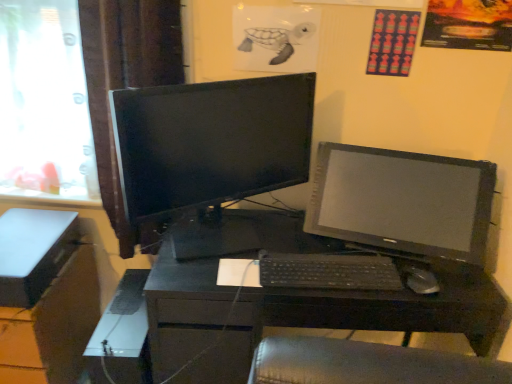
This screenshot has height=384, width=512. In order to click on vacant area situated below black glossy monitor at center, which is the 2th computer monitor in right-to-left order (from a real-world perspective) in this screenshot , I will do `click(227, 238)`.